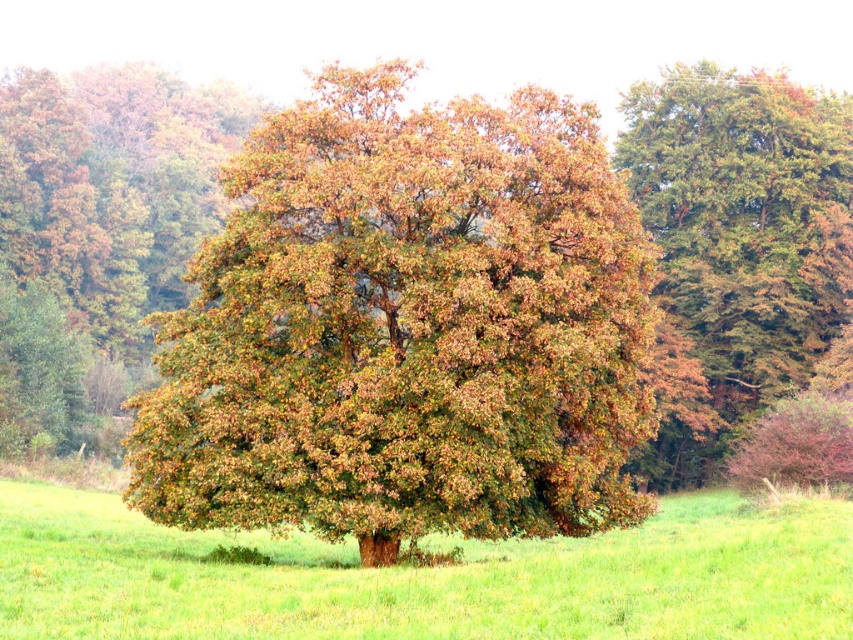
Is green grass at center in front of green textured tree at upper right?

Yes, green grass at center is closer to the viewer.

Does green grass at center lie behind green textured tree at upper right?

No, green grass at center is closer to the viewer.

Where is `green grass at center`? green grass at center is located at coordinates (427, 577).

In the scene shown: Between brown leafy oak tree at center and green textured tree at upper right, which one is positioned lower?

brown leafy oak tree at center is lower down.

This screenshot has height=640, width=853. I want to click on brown leafy oak tree at center, so click(x=405, y=328).

Locate an element on the screen. The width and height of the screenshot is (853, 640). brown leafy oak tree at center is located at coordinates (405, 328).

Find the location of a particular element. This screenshot has height=640, width=853. brown leafy oak tree at center is located at coordinates pyautogui.click(x=405, y=328).

Between brown leafy oak tree at center and green grass at center, which one appears on the left side from the viewer's perspective?

Positioned to the left is brown leafy oak tree at center.

Which is in front, point (236, 163) or point (222, 634)?

Point (222, 634) is more forward.

Find the location of a particular element. The image size is (853, 640). brown leafy oak tree at center is located at coordinates (405, 328).